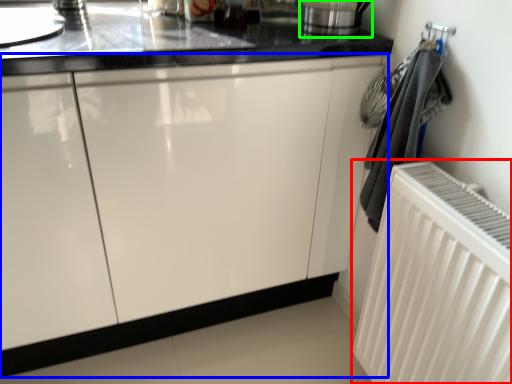
Question: Estimate the real-world distances between objects in this image. Which object is closer to radiator (highlighted by a red box), cabinetry (highlighted by a blue box) or appliance (highlighted by a green box)?

Choices:
 (A) cabinetry
 (B) appliance

Answer: (A)